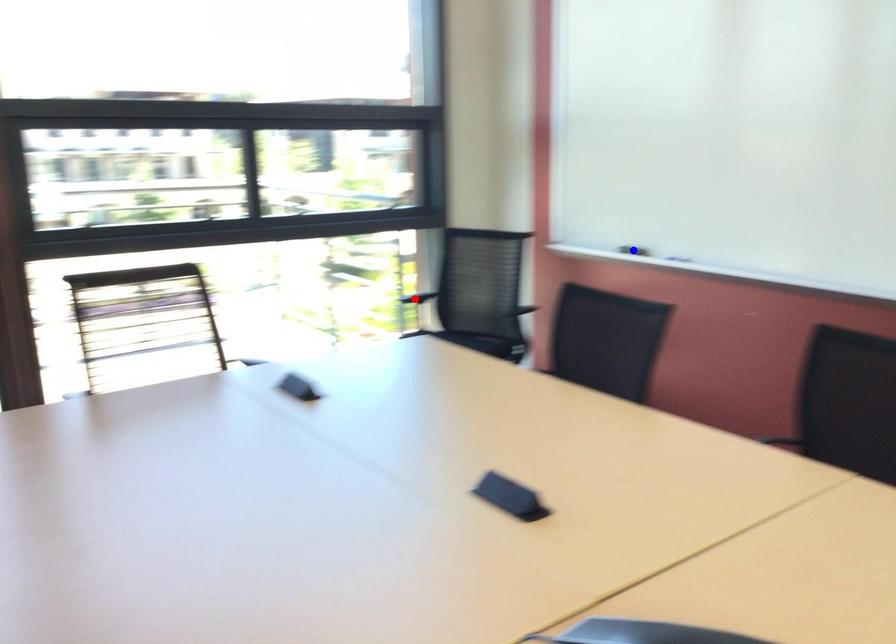
Question: Two points are marked on the image. Which point is closer to the camera?

Choices:
 (A) Blue point is closer.
 (B) Red point is closer.

Answer: (A)